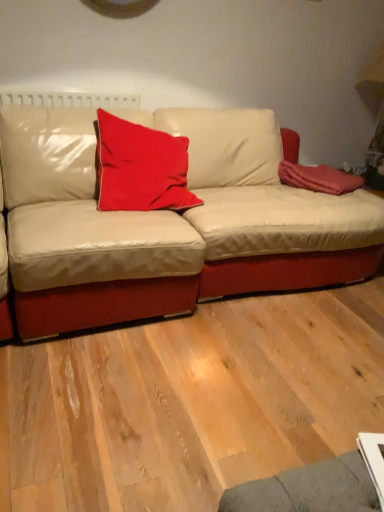
Measure the distance between point [101,204] and camera.

Point [101,204] is 1.93 meters from camera.

Based on the photo, what is the approximate width of red velvet cushion at center?

The width of red velvet cushion at center is 18.47 inches.

What do you see at coordinates (140, 167) in the screenshot?
I see `red velvet cushion at center` at bounding box center [140, 167].

At what (x,y) coordinates should I click in order to perform the action: click on red velvet cushion at center. Please return your answer as a coordinate pair (x, y). Looking at the image, I should click on (140, 167).

Identify the location of red velvet cushion at center. (140, 167).